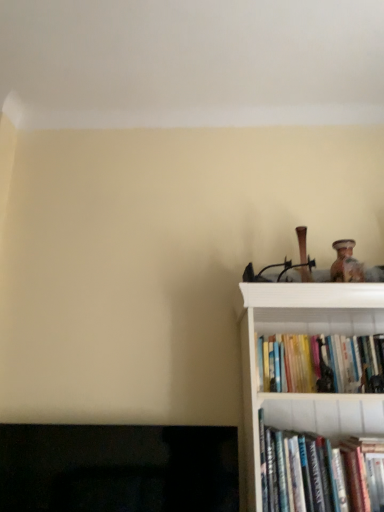
You are a GUI agent. You are given a task and a screenshot of the screen. Output one action in this format:
    pyautogui.click(x=<x>, y=<y>)
    Task: Click on the free point above hardcover books at right (from a real-world perspective)
    
    Given the screenshot: What is the action you would take?
    pyautogui.click(x=337, y=335)